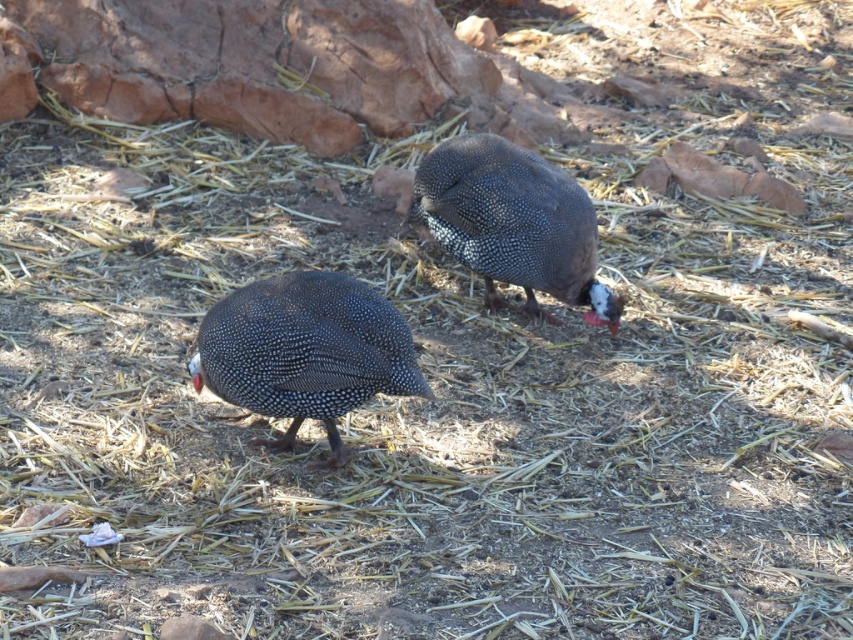
Question: Can you confirm if speckled feathered guinea fowl at center is positioned above speckled dark brown guinea fowl at center?

Choices:
 (A) yes
 (B) no

Answer: (B)

Question: Which point is farther to the camera?

Choices:
 (A) (349, 368)
 (B) (595, 280)

Answer: (B)

Question: Is speckled feathered guinea fowl at center behind speckled dark brown guinea fowl at center?

Choices:
 (A) no
 (B) yes

Answer: (A)

Question: Can you confirm if speckled feathered guinea fowl at center is positioned to the right of speckled dark brown guinea fowl at center?

Choices:
 (A) yes
 (B) no

Answer: (B)